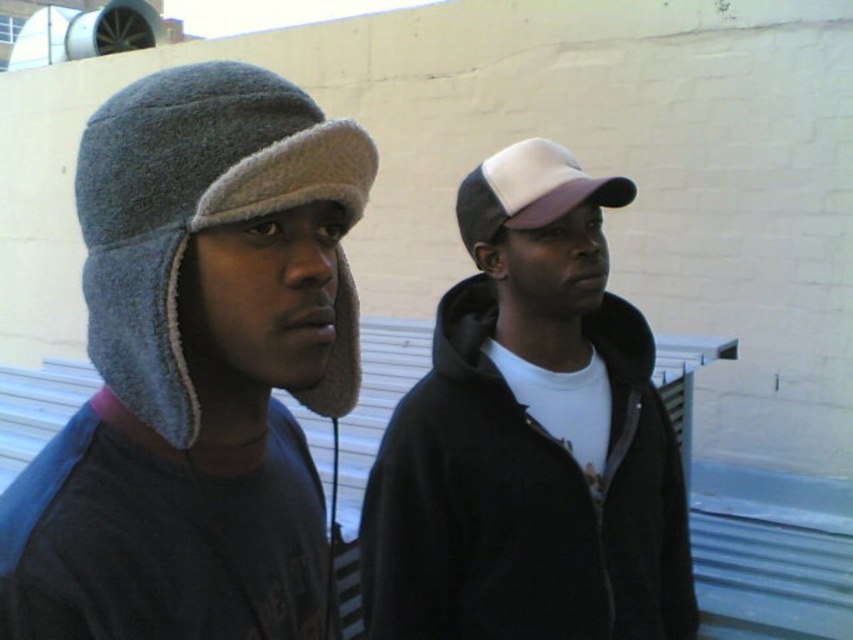
Question: Where is gray fleece hat at left located in relation to white fabric cap at center in the image?

Choices:
 (A) above
 (B) below

Answer: (A)

Question: Where is gray fleece hat at left located in relation to white mesh baseball cap at center in the image?

Choices:
 (A) below
 (B) above

Answer: (A)

Question: Can you confirm if gray fleece hat at left is positioned below white fabric cap at center?

Choices:
 (A) no
 (B) yes

Answer: (A)

Question: Based on their relative distances, which object is nearer to the white fabric cap at center?

Choices:
 (A) white mesh baseball cap at center
 (B) gray fleece hat at left

Answer: (A)

Question: Among these objects, which one is nearest to the camera?

Choices:
 (A) white fabric cap at center
 (B) gray fleece hat at left
 (C) white mesh baseball cap at center

Answer: (B)

Question: Estimate the real-world distances between objects in this image. Which object is closer to the white fabric cap at center?

Choices:
 (A) gray fleece hat at left
 (B) white mesh baseball cap at center

Answer: (B)